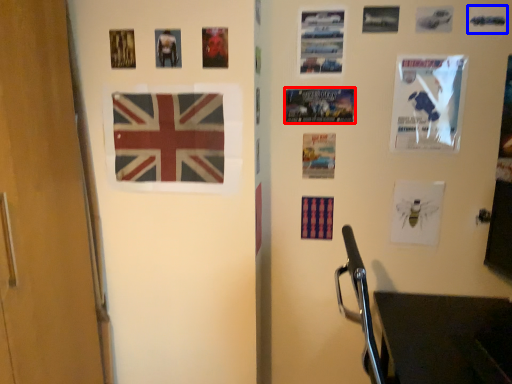
Question: Which object appears farthest to the camera in this image, poster page (highlighted by a red box) or poster page (highlighted by a blue box)?

Choices:
 (A) poster page
 (B) poster page

Answer: (A)